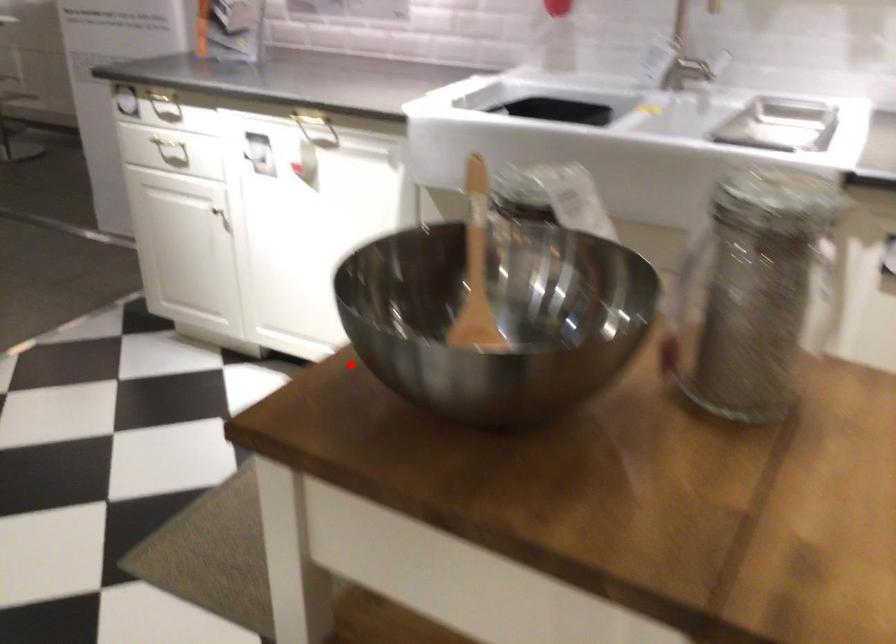
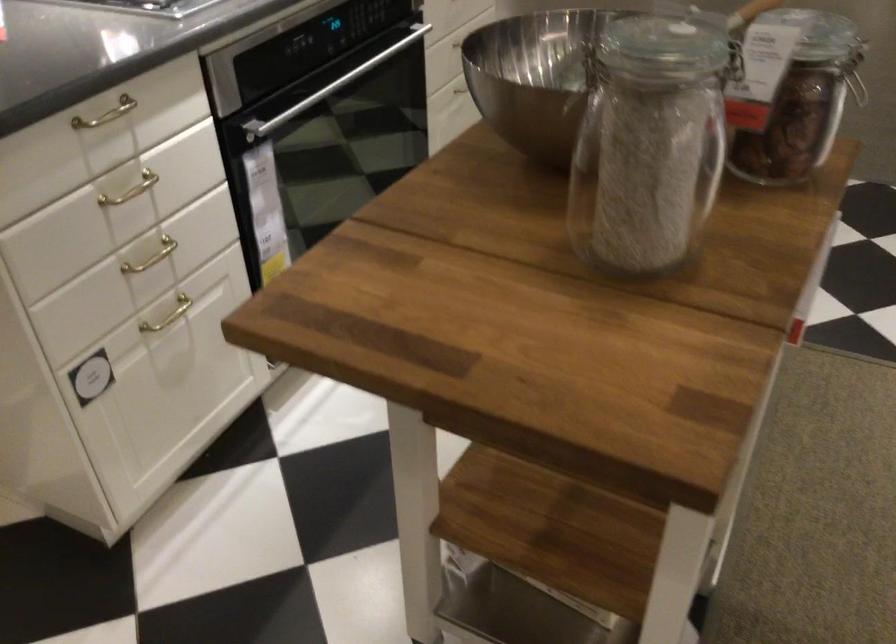
Question: I am providing you with two images of the same scene from different viewpoints. Image1 has a red point marked. In image2, the corresponding 3D location appears at what relative position? Reply with the corresponding letter.

Choices:
 (A) Closer
 (B) Farther

Answer: (B)